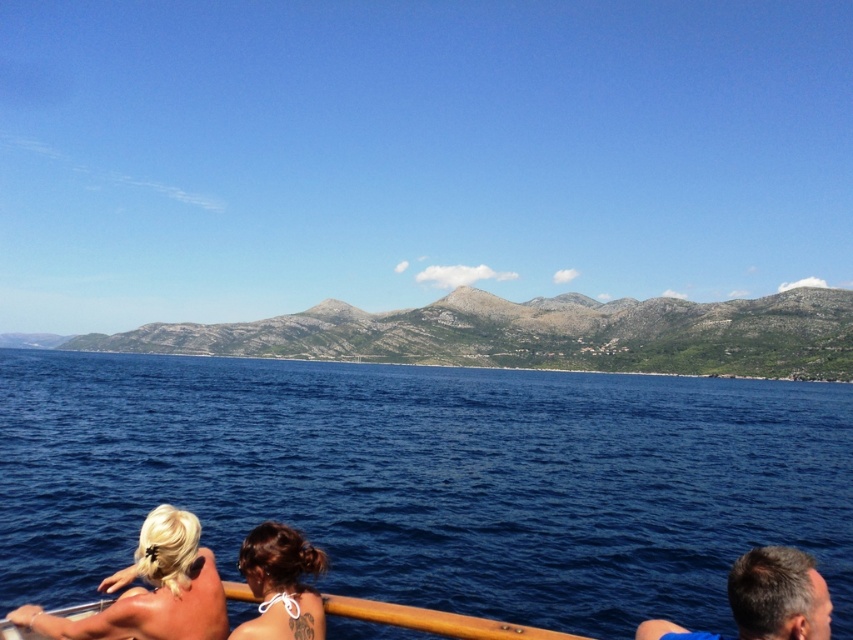
Is point (132, 614) behind point (308, 570)?

No, it is in front of (308, 570).

From the picture: Does blonde hair at lower left have a lesser height compared to dark brown hair at lower center?

No.

Where is `blonde hair at lower left`? Image resolution: width=853 pixels, height=640 pixels. blonde hair at lower left is located at coordinates (149, 589).

Find the location of a particular element. The height and width of the screenshot is (640, 853). deep blue water at center is located at coordinates (428, 481).

Does deep blue water at center appear on the left side of blonde hair at lower left?

Correct, you'll find deep blue water at center to the left of blonde hair at lower left.

Where is `deep blue water at center`? This screenshot has height=640, width=853. deep blue water at center is located at coordinates (428, 481).

Can you confirm if deep blue water at center is positioned to the left of dark brown hair at lower center?

Indeed, deep blue water at center is positioned on the left side of dark brown hair at lower center.

Between deep blue water at center and dark brown hair at lower center, which one appears on the left side from the viewer's perspective?

deep blue water at center

Who is more distant from viewer, (166, 397) or (276, 637)?

The point (166, 397) is behind.

At what (x,y) coordinates should I click in order to perform the action: click on deep blue water at center. Please return your answer as a coordinate pair (x, y). The width and height of the screenshot is (853, 640). Looking at the image, I should click on (428, 481).